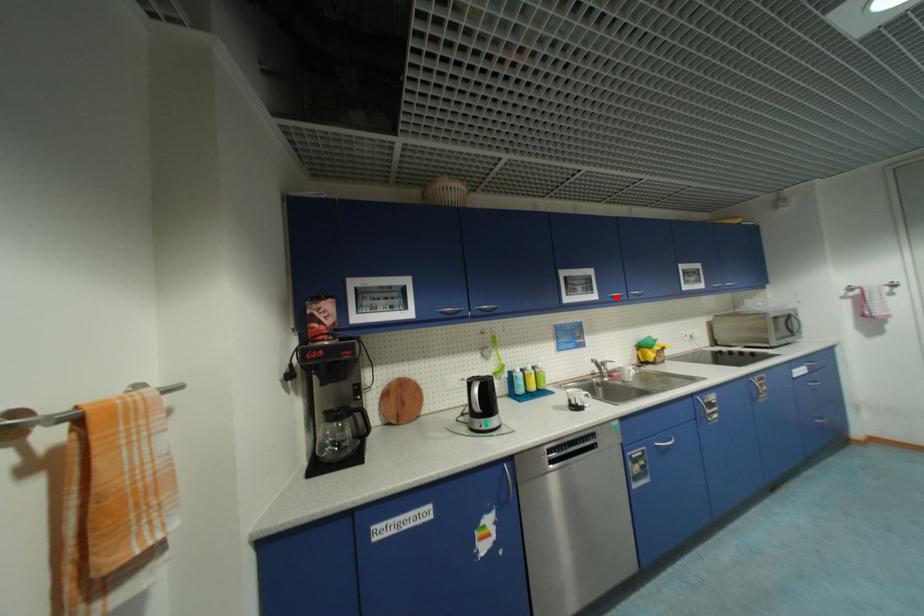
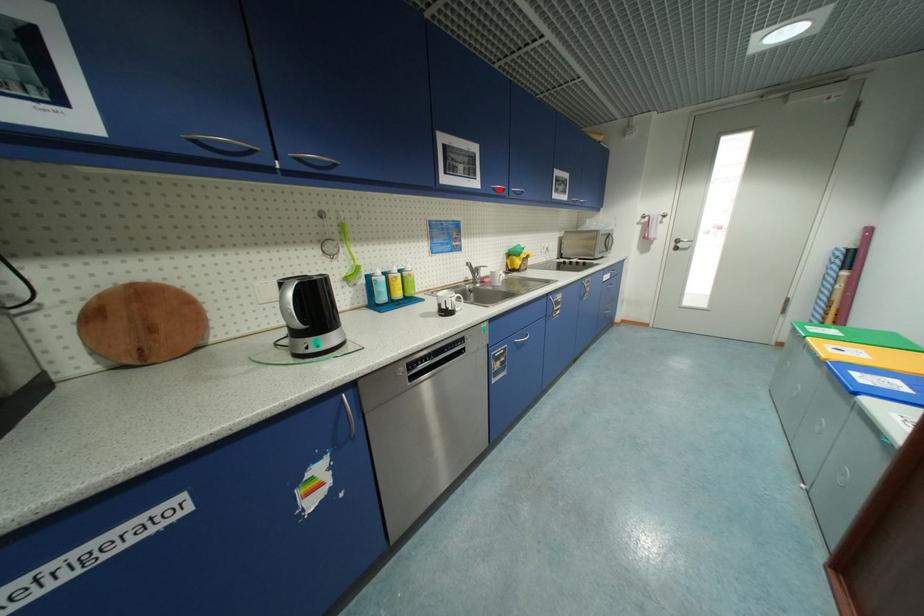
I am providing you with two images of the same scene from different viewpoints. A red point is marked on the first image and another point is marked on the second image. Does the point marked in image1 correspond to the same location as the one in image2?

Yes